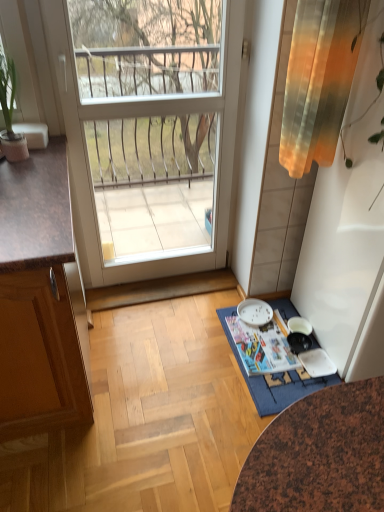
Image resolution: width=384 pixels, height=512 pixels. Find the location of `free spot above blue fabric doormat at lower center (from a real-world perspective)`. free spot above blue fabric doormat at lower center (from a real-world perspective) is located at coordinates (277, 348).